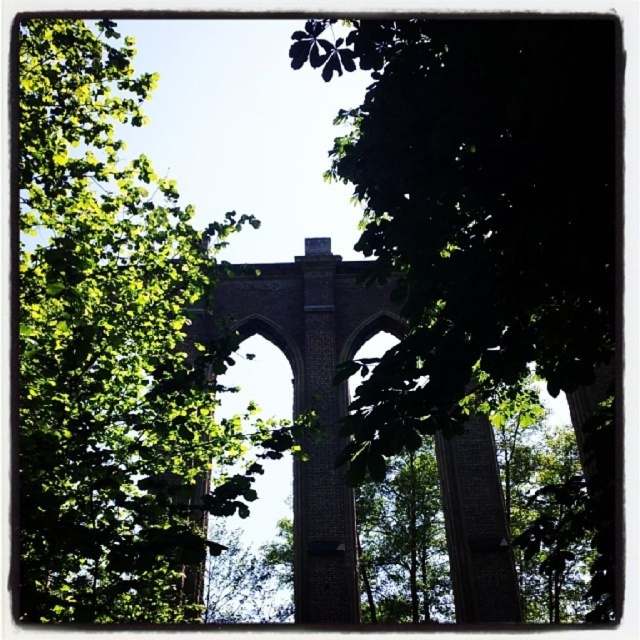
You are standing in front of the historic viaduct surrounded by green foliage. You notice two points marked on the structure. The first point is at coordinate point (449,312) and the second is at point (166,508). Which of these two points is nearer to your current viewpoint?

Point (449,312) is closer to the camera than point (166,508), so the first point is nearer to your viewpoint.

You are a hiker standing near the historic viaduct. You see the green leafy tree at center and the green leafy tree at left. Which tree would appear larger to you?

The green leafy tree at center is closer to the viewer than the green leafy tree at left, so it would appear larger.

You are a drone operator trying to capture a photo of the historic viaduct. You need to ensure the green leafy tree at center doesn not block the view of the viaduct. Can you position the drone to the left or right of the tree to get a clear shot? Please specify the direction based on the tree location.

The green leafy tree at center is located at coordinates point [486,243]. Since the tree is at the center, positioning the drone to either the left or right side of the tree would allow you to capture a clear view of the viaduct without obstruction.